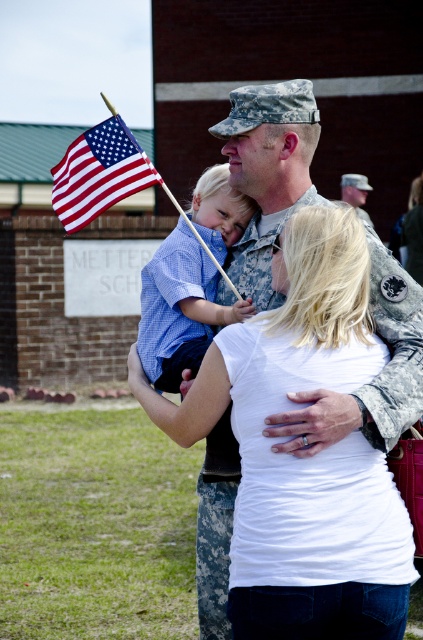
Can you confirm if white matte shirt at center is smaller than camouflage uniform at center?

No.

Is white matte shirt at center to the left of camouflage uniform at center from the viewer's perspective?

Yes, white matte shirt at center is to the left of camouflage uniform at center.

Identify the location of white matte shirt at center. pyautogui.click(x=302, y=460).

The height and width of the screenshot is (640, 423). I want to click on white matte shirt at center, so (x=302, y=460).

Does polyester american flag at upper left appear under camouflage uniform at center?

Yes, polyester american flag at upper left is below camouflage uniform at center.

Can you confirm if polyester american flag at upper left is positioned to the right of camouflage uniform at center?

Incorrect, polyester american flag at upper left is not on the right side of camouflage uniform at center.

Does point (74, 150) lie behind point (353, 186)?

No, it is in front of (353, 186).

Where is `polyester american flag at upper left`? The image size is (423, 640). polyester american flag at upper left is located at coordinates (98, 172).

Can you confirm if white matte shirt at center is thinner than checkered shirt at center?

No.

Does white matte shirt at center come behind checkered shirt at center?

That is False.

Is point (353, 557) closer to viewer compared to point (167, 310)?

Yes, it is.

You are a GUI agent. You are given a task and a screenshot of the screen. Output one action in this format:
    pyautogui.click(x=<x>, y=<y>)
    Task: Click on the white matte shirt at center
    The image size is (423, 640).
    Given the screenshot: What is the action you would take?
    pyautogui.click(x=302, y=460)